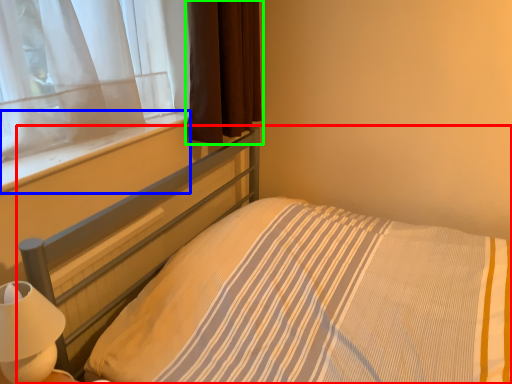
Question: Which object is positioned closest to bed (highlighted by a red box)? Select from window sill (highlighted by a blue box) and curtain (highlighted by a green box).

Choices:
 (A) window sill
 (B) curtain

Answer: (A)